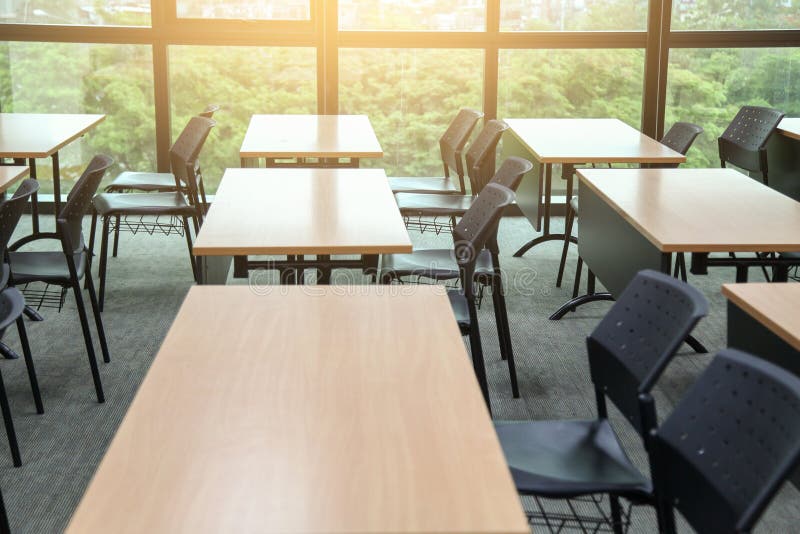
Identify the location of basket under chair. The image size is (800, 534). (426, 223), (158, 226), (416, 279), (793, 272), (48, 290), (561, 517), (121, 190).